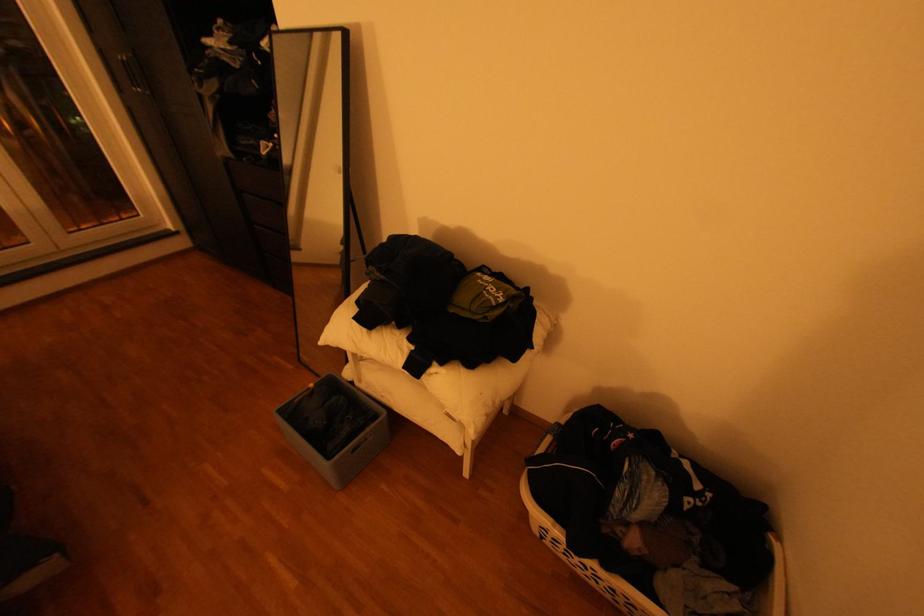
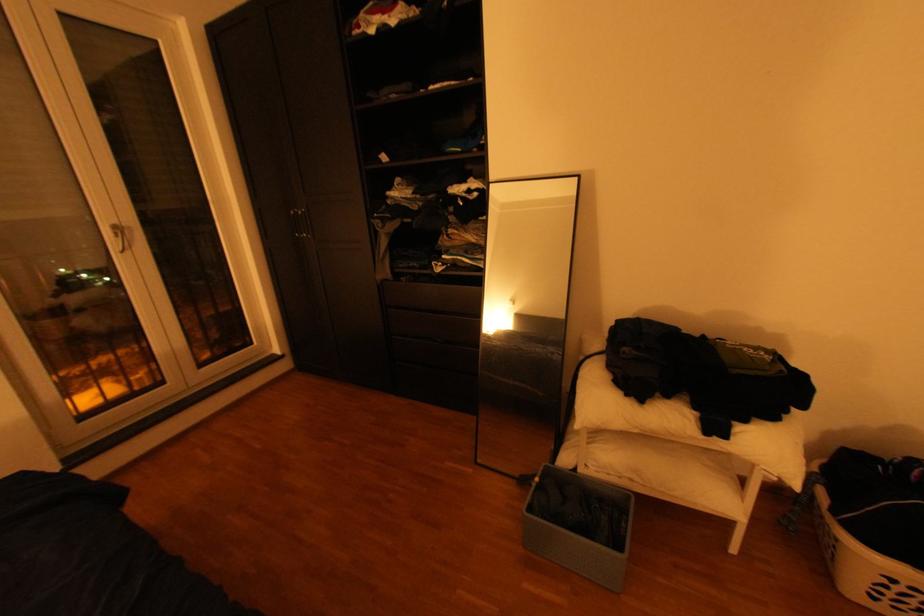
Locate, in the second image, the point that corresponds to point (313, 359) in the first image.

(488, 460)